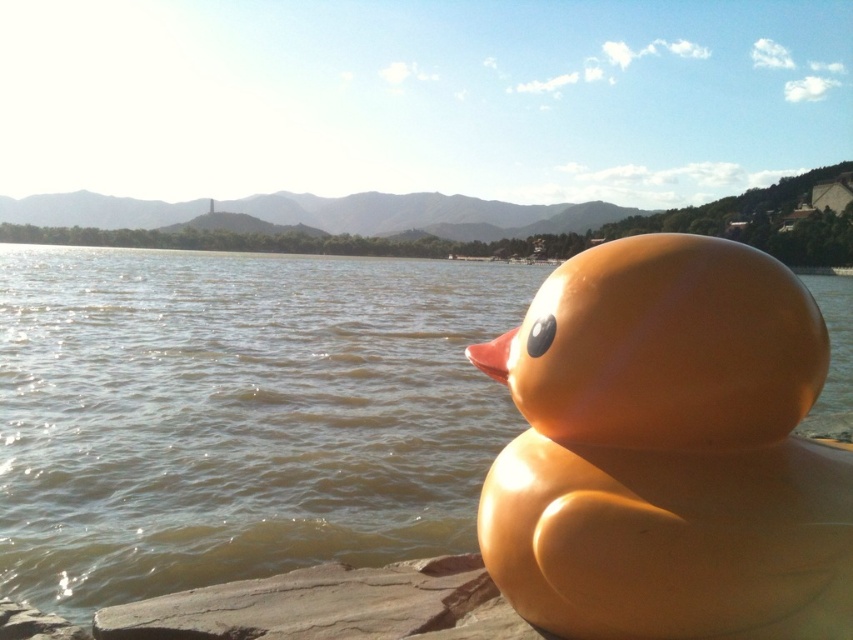
Question: Can you confirm if translucent water at duck right is positioned above glossy rubber duck at right?

Choices:
 (A) no
 (B) yes

Answer: (B)

Question: Can you confirm if translucent water at duck right is positioned to the right of glossy rubber duck at right?

Choices:
 (A) yes
 (B) no

Answer: (B)

Question: Among these points, which one is farthest from the camera?

Choices:
 (A) (553, 413)
 (B) (268, 445)

Answer: (B)

Question: Can you confirm if translucent water at duck right is smaller than glossy rubber duck at right?

Choices:
 (A) no
 (B) yes

Answer: (A)

Question: Among these points, which one is farthest from the camera?

Choices:
 (A) (534, 580)
 (B) (434, 493)

Answer: (B)